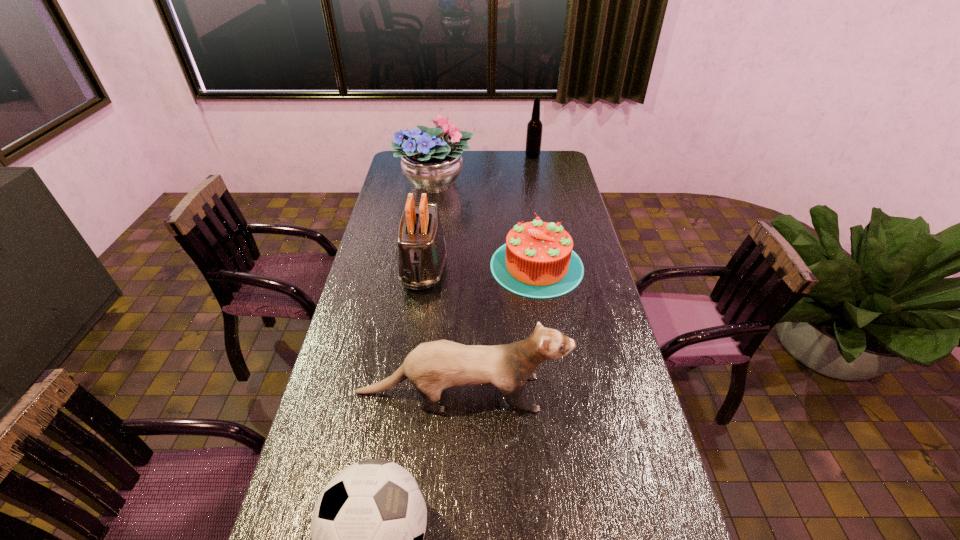
Locate an element on the screen. This screenshot has height=540, width=960. the farthest object is located at coordinates (534, 127).

This screenshot has width=960, height=540. In order to click on bouquet in this screenshot , I will do `click(432, 164)`.

Locate an element on the screen. toaster is located at coordinates (422, 254).

I want to click on the second nearest object, so click(x=434, y=366).

Locate an element on the screen. The width and height of the screenshot is (960, 540). cake is located at coordinates (537, 261).

You are a GUI agent. You are given a task and a screenshot of the screen. Output one action in this format:
    pyautogui.click(x=<x>, y=<y>)
    Task: Click on the vacant point located 0.270m on the left of the beer bottle
    This screenshot has width=960, height=540.
    Given the screenshot: What is the action you would take?
    pyautogui.click(x=473, y=156)

Where is `vacant space located 0.070m on the back of the second farthest object`? This screenshot has height=540, width=960. vacant space located 0.070m on the back of the second farthest object is located at coordinates click(439, 156).

You are a GUI agent. You are given a task and a screenshot of the screen. Output one action in this format:
    pyautogui.click(x=<x>, y=<y>)
    Task: Click on the vacant space located 0.060m on the side of the toaster with the control lever
    
    Given the screenshot: What is the action you would take?
    pyautogui.click(x=418, y=309)

You are a GUI agent. You are given a task and a screenshot of the screen. Output one action in this format:
    pyautogui.click(x=<x>, y=<y>)
    Task: Click on the vacant space located 0.130m on the face of the second nearest object
    This screenshot has height=540, width=960.
    Given the screenshot: What is the action you would take?
    pyautogui.click(x=612, y=393)

Where is `blank area located 0.240m on the left of the cake`? The width and height of the screenshot is (960, 540). blank area located 0.240m on the left of the cake is located at coordinates (426, 266).